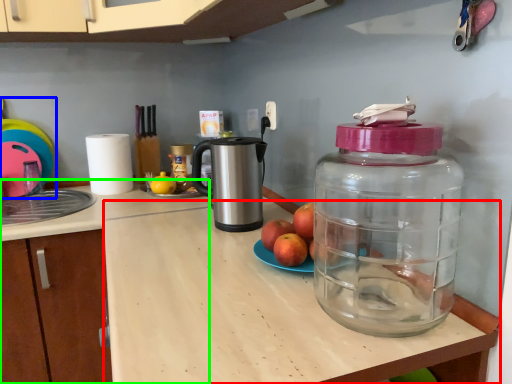
Question: Estimate the real-world distances between objects in this image. Which object is farther from counter top (highlighted by a red box), toy (highlighted by a blue box) or counter top (highlighted by a green box)?

Choices:
 (A) toy
 (B) counter top

Answer: (A)